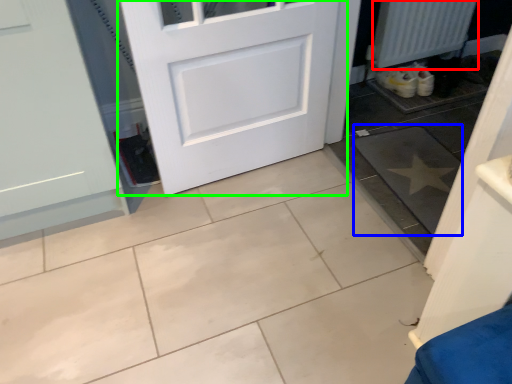
Question: Based on their relative distances, which object is nearer to radiator (highlighted by a red box)? Choose from ceramic tile (highlighted by a blue box) and door (highlighted by a green box).

Choices:
 (A) ceramic tile
 (B) door

Answer: (A)